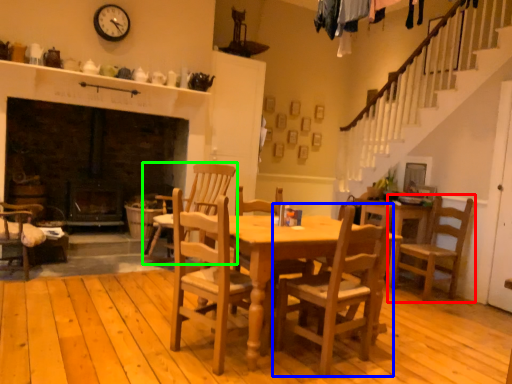
Question: Based on their relative distances, which object is nearer to chair (highlighted by a red box)? Choose from chair (highlighted by a blue box) and chair (highlighted by a green box).

Choices:
 (A) chair
 (B) chair

Answer: (A)